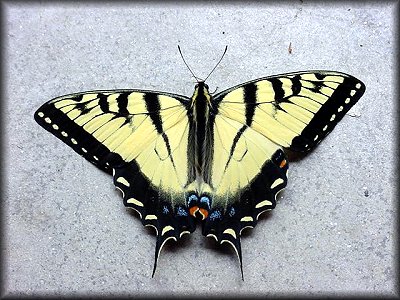
Where is `grey floor`? This screenshot has width=400, height=300. grey floor is located at coordinates (316, 246).